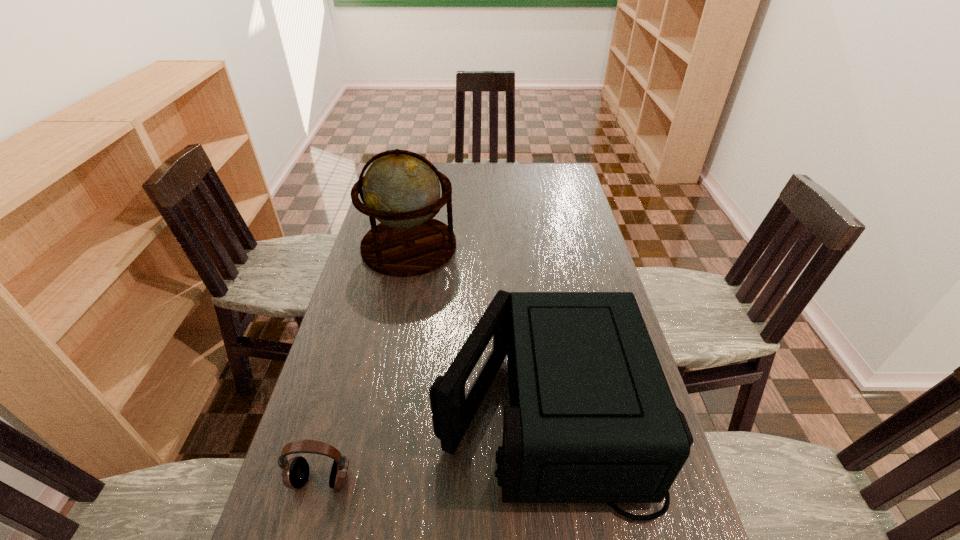
Identify the location of vacant region that satisfies the following two spatial constraints: 1. on the front-facing side of the farthest object; 2. on the ear pads of the shortest object. (362, 480).